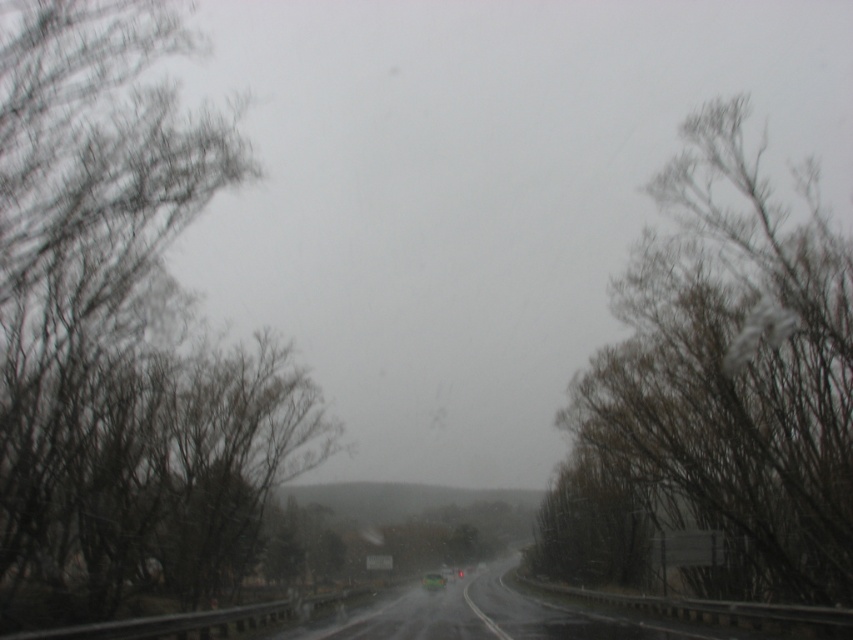
Is bare branches at left further to the viewer compared to transparent glass windshield at center?

No, it is in front of transparent glass windshield at center.

Does point (25, 488) come closer to viewer compared to point (430, 582)?

That is True.

Is point (138, 540) behind point (422, 586)?

No.

Locate an element on the screen. Image resolution: width=853 pixels, height=640 pixels. bare branches at left is located at coordinates (x=120, y=332).

Can you confirm if bare branches at left is positioned to the left of bare branches at right?

Correct, you'll find bare branches at left to the left of bare branches at right.

Does point (32, 339) lie in front of point (631, 314)?

Yes, it is.

I want to click on bare branches at left, so click(x=120, y=332).

Can you confirm if smooth asphalt highway at center is thinner than transparent glass windshield at center?

In fact, smooth asphalt highway at center might be wider than transparent glass windshield at center.

Identify the location of smooth asphalt highway at center. Image resolution: width=853 pixels, height=640 pixels. (486, 614).